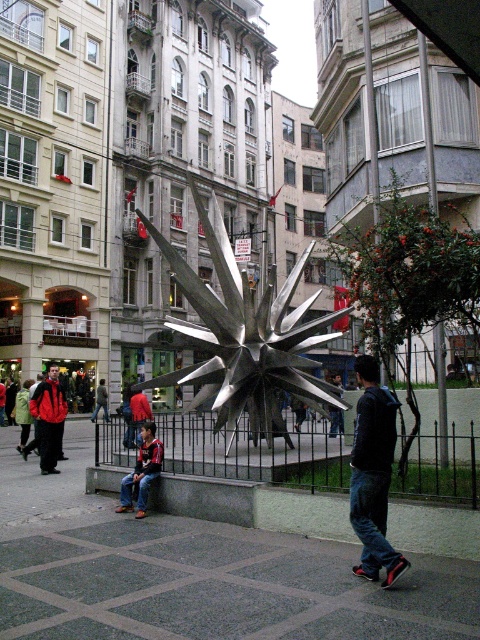
Does point (294, 349) come behind point (362, 429)?

Yes, it is.

Consider the image. Can you confirm if metallic starburst at center is wider than dark blue jeans at center?

Indeed, metallic starburst at center has a greater width compared to dark blue jeans at center.

Does point (305, 392) lie in front of point (365, 397)?

That is False.

Find the location of a particular element. This screenshot has width=480, height=640. metallic starburst at center is located at coordinates (245, 336).

Who is more distant from viewer, (84, 516) or (140, 426)?

The point (140, 426) is more distant.

Can you confirm if gray concrete pavement at center is taller than red jacket at lower left?

No.

Find the location of `gray concrete pavement at center`. gray concrete pavement at center is located at coordinates (195, 572).

The width and height of the screenshot is (480, 640). Find the location of `gray concrete pavement at center`. gray concrete pavement at center is located at coordinates (195, 572).

Does gray concrete pavement at center appear on the left side of dark blue jeans at center?

Indeed, gray concrete pavement at center is positioned on the left side of dark blue jeans at center.

Can you confirm if gray concrete pavement at center is shorter than dark blue jeans at center?

Yes, gray concrete pavement at center is shorter than dark blue jeans at center.

Does point (345, 513) come in front of point (384, 502)?

No, (345, 513) is behind (384, 502).

Where is `gray concrete pavement at center`? The height and width of the screenshot is (640, 480). gray concrete pavement at center is located at coordinates (195, 572).